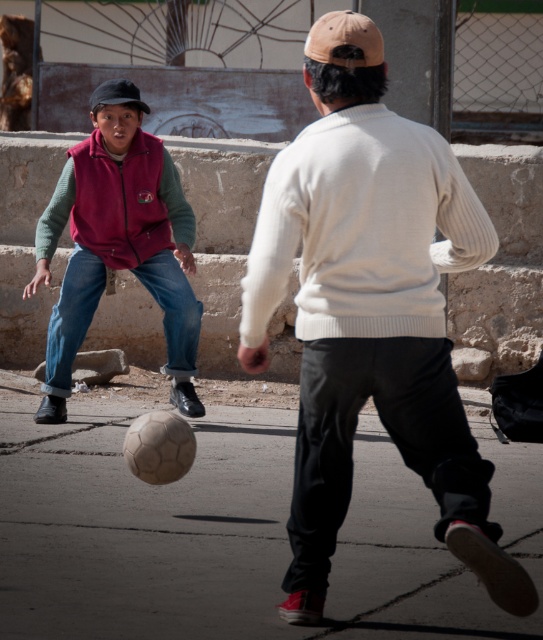
You are a soccer referee observing the game. You notice two players wearing matte red vest at left and matte pink vest at left. Which player should you call for a foul if they jump higher than the other?

The matte red vest at left is taller than the matte pink vest at left, so if they jump higher, the matte red vest at left player might have an advantage in height, but fouls are determined by actions violating rules, not height alone. However, based on height, the taller player could potentially reach higher, so if a foul occurs due to height advantage, the referee should address the matte red vest at left player.

You are a soccer referee observing the game. You notice two players wearing matte red vest at left and matte pink vest at left. Which player is positioned lower on the field?

The matte red vest at left is positioned below the matte pink vest at left, so the player wearing the matte red vest at left is lower on the field.

You are a soccer referee observing the game. You need to ensure that both players are wearing appropriate clothing. The rules state that the sweater must be thicker than the vest. Based on the image, does the white knit sweater at center meet the requirement compared to the matte red vest at left?

The white knit sweater at center is thinner than the matte red vest at left, so it does not meet the requirement as it should be thicker than the vest.